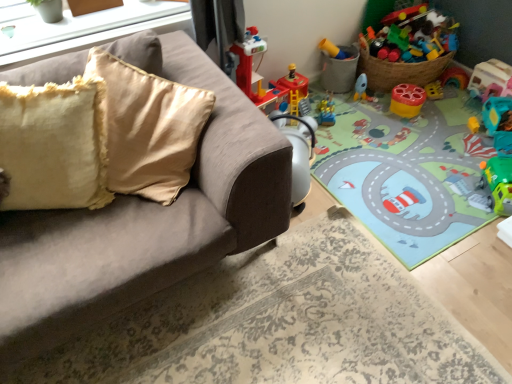
How much space does yellow plastic cup at center-right, acting as the 4th toy starting from the right, occupy vertically?

yellow plastic cup at center-right, acting as the 4th toy starting from the right, is 5.84 inches in height.

What do you see at coordinates (326, 110) in the screenshot? Image resolution: width=512 pixels, height=384 pixels. I see `translucent plastic toy at center, the 1th toy positioned from the left` at bounding box center [326, 110].

This screenshot has height=384, width=512. What do you see at coordinates (490, 80) in the screenshot?
I see `translucent plastic toy car at upper right, which is the sixth toy in left-to-right order` at bounding box center [490, 80].

What is the approximate height of green plastic toy car at lower right, which is the 4th toy in left-to-right order?

6.83 inches.

The width and height of the screenshot is (512, 384). I want to click on green plastic toy car at lower right, which is the 4th toy in left-to-right order, so click(x=498, y=183).

What are the coordinates of `yellow plastic cup at center-right, acting as the 4th toy starting from the right` in the screenshot? It's located at (407, 100).

Is matte white window sill at upper left completely or partially outside of yellow plastic cup at center-right, the 3th toy from the left?

That's correct, matte white window sill at upper left is outside of yellow plastic cup at center-right, the 3th toy from the left.

Considering the sizes of matte white window sill at upper left and yellow plastic cup at center-right, the 3th toy from the left, in the image, is matte white window sill at upper left wider or thinner than yellow plastic cup at center-right, the 3th toy from the left,?

Considering their sizes, matte white window sill at upper left looks broader than yellow plastic cup at center-right, the 3th toy from the left.

From the image's perspective, which is above, matte white window sill at upper left or yellow plastic cup at center-right, acting as the 4th toy starting from the right?

matte white window sill at upper left appears higher in the image.

How many degrees apart are the facing directions of matte white window sill at upper left and yellow plastic cup at center-right, acting as the 4th toy starting from the right?

87.6 degrees separate the facing orientations of matte white window sill at upper left and yellow plastic cup at center-right, acting as the 4th toy starting from the right.

Could you measure the distance between rubber duck at lower right, placed as the 2th toy when sorted from right to left, and yellow plastic cup at center-right, the 3th toy from the left?

rubber duck at lower right, placed as the 2th toy when sorted from right to left, and yellow plastic cup at center-right, the 3th toy from the left, are 16.12 inches apart from each other.

Which object is positioned more to the right, rubber duck at lower right, marked as the fifth toy in a left-to-right arrangement, or yellow plastic cup at center-right, the 3th toy from the left?

From the viewer's perspective, rubber duck at lower right, marked as the fifth toy in a left-to-right arrangement, appears more on the right side.

From the image's perspective, between rubber duck at lower right, placed as the 2th toy when sorted from right to left, and yellow plastic cup at center-right, the 3th toy from the left, which one is located above?

From the image's view, yellow plastic cup at center-right, the 3th toy from the left, is above.

Considering the relative positions of rubber duck at lower right, marked as the fifth toy in a left-to-right arrangement, and yellow plastic cup at center-right, acting as the 4th toy starting from the right, in the image provided, is rubber duck at lower right, marked as the fifth toy in a left-to-right arrangement, in front of yellow plastic cup at center-right, acting as the 4th toy starting from the right,?

That is True.

Looking at their sizes, would you say suede-like gray couch at upper left is wider or thinner than fuzzy yellow pillow at left?

suede-like gray couch at upper left is wider than fuzzy yellow pillow at left.

Looking at this image, is suede-like gray couch at upper left in front of or behind fuzzy yellow pillow at left in the image?

In the image, suede-like gray couch at upper left appears in front of fuzzy yellow pillow at left.

From a real-world perspective, is suede-like gray couch at upper left physically located above or below fuzzy yellow pillow at left?

In terms of real-world spatial position, suede-like gray couch at upper left is below fuzzy yellow pillow at left.

From the picture: What's the angular difference between suede-like gray couch at upper left and fuzzy yellow pillow at left's facing directions?

There is a 15.2-degree angle between the facing directions of suede-like gray couch at upper left and fuzzy yellow pillow at left.

Which is more to the left, matte plastic bucket at upper right, which ranks as the fifth toy in right-to-left order, or suede-like gray couch at upper left?

suede-like gray couch at upper left.

Are matte plastic bucket at upper right, which is the 2th toy from left to right, and suede-like gray couch at upper left far apart?

Indeed, matte plastic bucket at upper right, which is the 2th toy from left to right, is not near suede-like gray couch at upper left.

Does point (351, 78) come farther from viewer compared to point (246, 238)?

Yes.

Is suede-like gray couch at upper left a part of matte plastic bucket at upper right, which ranks as the fifth toy in right-to-left order?

No, matte plastic bucket at upper right, which ranks as the fifth toy in right-to-left order, does not contain suede-like gray couch at upper left.

Looking at this image, can you confirm if translucent plastic toy car at upper right, which is the sixth toy in left-to-right order, is bigger than matte plastic bucket at upper right, which ranks as the fifth toy in right-to-left order?

Incorrect, translucent plastic toy car at upper right, which is the sixth toy in left-to-right order, is not larger than matte plastic bucket at upper right, which ranks as the fifth toy in right-to-left order.

Could you measure the distance between translucent plastic toy car at upper right, the first toy when ordered from right to left, and matte plastic bucket at upper right, which is the 2th toy from left to right?

translucent plastic toy car at upper right, the first toy when ordered from right to left, and matte plastic bucket at upper right, which is the 2th toy from left to right, are 30.48 inches apart.

Is translucent plastic toy car at upper right, the first toy when ordered from right to left, positioned far away from matte plastic bucket at upper right, which ranks as the fifth toy in right-to-left order?

No, translucent plastic toy car at upper right, the first toy when ordered from right to left, is not far away from matte plastic bucket at upper right, which ranks as the fifth toy in right-to-left order.

Is point (500, 63) positioned in front of point (342, 70)?

Yes.

Between suede-like gray couch at upper left and translucent plastic toy car at upper right, the first toy when ordered from right to left, which one has less height?

Standing shorter between the two is translucent plastic toy car at upper right, the first toy when ordered from right to left.

Can translucent plastic toy car at upper right, which is the sixth toy in left-to-right order, be found inside suede-like gray couch at upper left?

Definitely not — translucent plastic toy car at upper right, which is the sixth toy in left-to-right order, is not inside suede-like gray couch at upper left.

In the image, is suede-like gray couch at upper left on the left side or the right side of translucent plastic toy car at upper right, which is the sixth toy in left-to-right order?

In the image, suede-like gray couch at upper left appears on the left side of translucent plastic toy car at upper right, which is the sixth toy in left-to-right order.

Is matte plastic bucket at upper right, which is the 2th toy from left to right, positioned before green plastic toy car at lower right, which is the 4th toy in left-to-right order?

No, it is not.

Which is closer, (x=346, y=90) or (x=490, y=179)?

The point (x=490, y=179) is closer.

Is matte plastic bucket at upper right, which ranks as the fifth toy in right-to-left order, oriented towards green plastic toy car at lower right, which is the 4th toy in left-to-right order?

Yes.

You are a GUI agent. You are given a task and a screenshot of the screen. Output one action in this format:
    pyautogui.click(x=<x>, y=<y>)
    Task: Click on the 2nd toy to the right when counting from the matte plastic bucket at upper right, which ranks as the fifth toy in right-to-left order
    The height and width of the screenshot is (384, 512).
    Given the screenshot: What is the action you would take?
    pyautogui.click(x=498, y=183)

This screenshot has height=384, width=512. Identify the location of toy that is the 5th one below the matte white window sill at upper left (from a real-world perspective). pyautogui.click(x=407, y=100).

Find the location of a particular element. This screenshot has height=384, width=512. the 2nd toy to the left when counting from the rubber duck at lower right, marked as the fifth toy in a left-to-right arrangement is located at coordinates (407, 100).

Which object lies nearer to the anchor point translucent plastic toy at center, the 1th toy positioned from the left, fuzzy yellow pillow at left or green plastic toy car at lower right, which is the 4th toy in left-to-right order?

The object closer to translucent plastic toy at center, the 1th toy positioned from the left, is green plastic toy car at lower right, which is the 4th toy in left-to-right order.

Which object lies further to the anchor point translucent plastic toy car at upper right, which is the sixth toy in left-to-right order, green plastic toy car at lower right, the third toy from the right, or translucent plastic toy at center, the 1th toy positioned from the left?

translucent plastic toy at center, the 1th toy positioned from the left, is positioned further to the anchor translucent plastic toy car at upper right, which is the sixth toy in left-to-right order.

In the scene shown: Considering their positions, is translucent plastic toy at center, the 1th toy positioned from the left, positioned closer to yellow plastic cup at center-right, the 3th toy from the left, than fuzzy yellow pillow at left?

The object closer to yellow plastic cup at center-right, the 3th toy from the left, is translucent plastic toy at center, the 1th toy positioned from the left.

When comparing their distances from translucent plastic toy car at upper right, the first toy when ordered from right to left, does matte white window sill at upper left or matte plastic bucket at upper right, which ranks as the fifth toy in right-to-left order, seem further?

matte white window sill at upper left lies further to translucent plastic toy car at upper right, the first toy when ordered from right to left, than the other object.

Which object lies nearer to the anchor point fuzzy yellow pillow at left, yellow plastic cup at center-right, acting as the 4th toy starting from the right, or suede-like gray couch at upper left?

suede-like gray couch at upper left is closer to fuzzy yellow pillow at left.

When comparing their distances from translucent plastic toy car at upper right, the first toy when ordered from right to left, does fuzzy yellow pillow at left or matte plastic bucket at upper right, which is the 2th toy from left to right, seem closer?

matte plastic bucket at upper right, which is the 2th toy from left to right, is closer to translucent plastic toy car at upper right, the first toy when ordered from right to left.

From the image, which object appears to be nearer to fuzzy yellow pillow at left, yellow plastic cup at center-right, acting as the 4th toy starting from the right, or matte white window sill at upper left?

matte white window sill at upper left lies closer to fuzzy yellow pillow at left than the other object.

Estimate the real-world distances between objects in this image. Which object is closer to yellow plastic cup at center-right, the 3th toy from the left, fuzzy yellow pillow at left or matte white window sill at upper left?

matte white window sill at upper left is closer to yellow plastic cup at center-right, the 3th toy from the left.

I want to click on pillow between matte white window sill at upper left and matte plastic bucket at upper right, which is the 2th toy from left to right, from left to right, so pos(55,145).

The image size is (512, 384). In order to click on studio couch between matte white window sill at upper left and rubber duck at lower right, placed as the 2th toy when sorted from right to left in this screenshot , I will do `click(145, 224)`.

Find the location of `studio couch located between matte white window sill at upper left and translucent plastic toy car at upper right, the first toy when ordered from right to left, in the left-right direction`. studio couch located between matte white window sill at upper left and translucent plastic toy car at upper right, the first toy when ordered from right to left, in the left-right direction is located at coordinates (145, 224).

I want to click on window sill between suede-like gray couch at upper left and matte plastic bucket at upper right, which ranks as the fifth toy in right-to-left order, in the front-back direction, so click(72, 22).